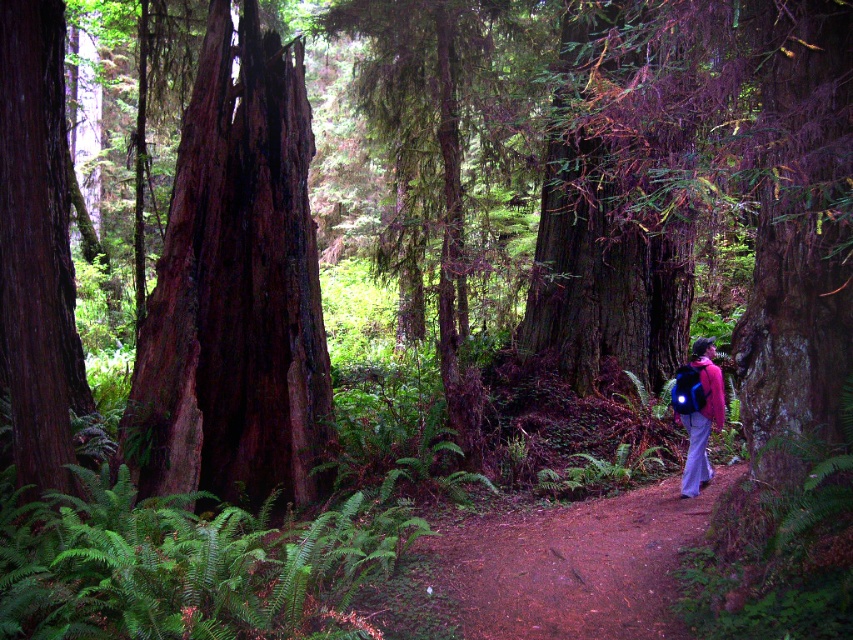
Question: Which of these objects is positioned closest to the dark brown bark tree at center?

Choices:
 (A) smooth reddish-brown trunk at left
 (B) dark brown wood at left
 (C) green leafy fern at lower left

Answer: (B)

Question: Can you confirm if dark brown wood at left is bigger than smooth reddish-brown trunk at left?

Choices:
 (A) no
 (B) yes

Answer: (B)

Question: Does green leafy fern at lower left appear on the left side of dark brown bark tree at center?

Choices:
 (A) yes
 (B) no

Answer: (A)

Question: Which point appears closest to the camera in this image?

Choices:
 (A) (169, 433)
 (B) (560, 323)
 (C) (706, 339)

Answer: (A)

Question: Among these objects, which one is farthest from the camera?

Choices:
 (A) brown dirt path at center
 (B) matte pink jacket at center

Answer: (B)

Question: Is dark brown bark tree at center further to camera compared to brown dirt path at center?

Choices:
 (A) yes
 (B) no

Answer: (A)